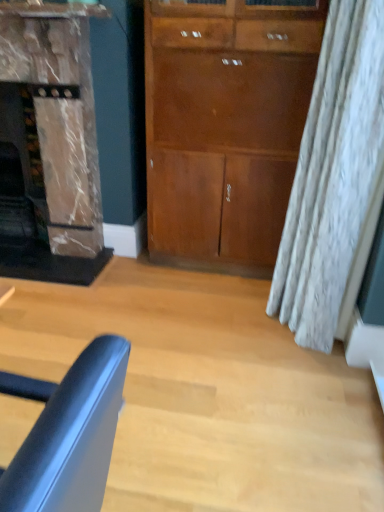
Question: Is matte brown fireplace at left inside matte wood cabinet at center?

Choices:
 (A) yes
 (B) no

Answer: (B)

Question: Can we say matte wood cabinet at center lies outside matte brown fireplace at left?

Choices:
 (A) yes
 (B) no

Answer: (A)

Question: Is matte wood cabinet at center positioned behind matte brown fireplace at left?

Choices:
 (A) yes
 (B) no

Answer: (B)

Question: Is matte wood cabinet at center oriented towards matte brown fireplace at left?

Choices:
 (A) yes
 (B) no

Answer: (B)

Question: Is matte wood cabinet at center wider than matte brown fireplace at left?

Choices:
 (A) no
 (B) yes

Answer: (A)

Question: Is matte wood cabinet at center taller or shorter than matte blue chair at lower left?

Choices:
 (A) short
 (B) tall

Answer: (B)

Question: From the image's perspective, is matte wood cabinet at center above or below matte blue chair at lower left?

Choices:
 (A) below
 (B) above

Answer: (B)

Question: Does point (289, 179) appear closer or farther from the camera than point (109, 349)?

Choices:
 (A) closer
 (B) farther

Answer: (B)

Question: From a real-world perspective, is matte wood cabinet at center positioned above or below matte blue chair at lower left?

Choices:
 (A) above
 (B) below

Answer: (A)

Question: From a real-world perspective, is matte brown fireplace at left positioned above or below matte blue chair at lower left?

Choices:
 (A) below
 (B) above

Answer: (B)

Question: Which is correct: matte brown fireplace at left is inside matte blue chair at lower left, or outside of it?

Choices:
 (A) inside
 (B) outside

Answer: (B)

Question: Considering the positions of point (44, 37) and point (97, 391), is point (44, 37) closer or farther from the camera than point (97, 391)?

Choices:
 (A) farther
 (B) closer

Answer: (A)

Question: In terms of size, does matte brown fireplace at left appear bigger or smaller than matte blue chair at lower left?

Choices:
 (A) big
 (B) small

Answer: (A)

Question: Looking at their shapes, would you say matte wood cabinet at center is wider or thinner than matte brown fireplace at left?

Choices:
 (A) wide
 (B) thin

Answer: (B)

Question: Visually, is matte wood cabinet at center positioned to the left or to the right of matte brown fireplace at left?

Choices:
 (A) left
 (B) right

Answer: (B)